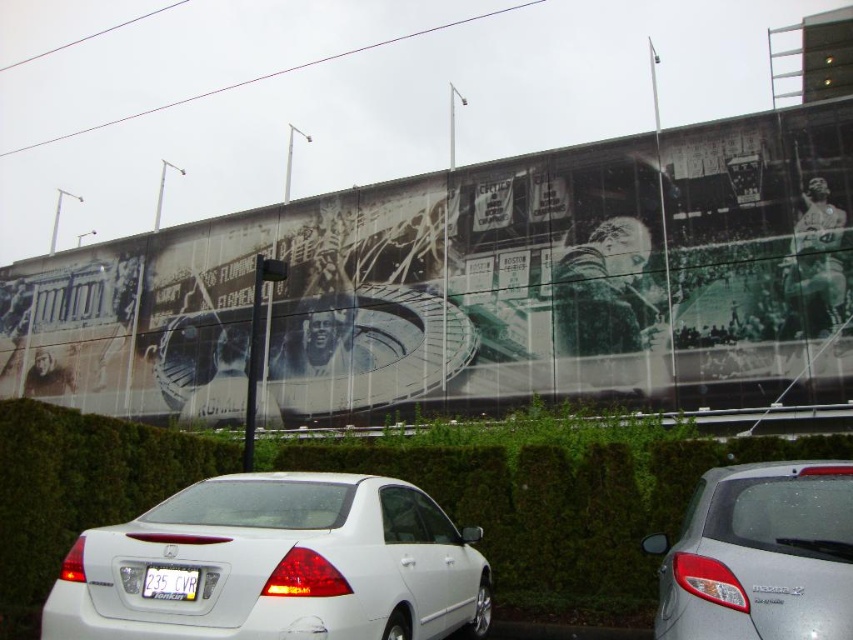
Question: Does black and white mural at center have a smaller size compared to white plastic license plate at center?

Choices:
 (A) yes
 (B) no

Answer: (B)

Question: Is the position of black and white mural at center less distant than that of silver metallic hatchback at center?

Choices:
 (A) yes
 (B) no

Answer: (B)

Question: From the image, what is the correct spatial relationship of black and white mural at center in relation to white glossy sedan at center?

Choices:
 (A) left
 (B) right

Answer: (A)

Question: Which point is farther to the camera?

Choices:
 (A) (61, 440)
 (B) (378, 588)
 (C) (672, 632)

Answer: (A)

Question: Which point appears farthest from the camera in this image?

Choices:
 (A) click(x=495, y=508)
 (B) click(x=675, y=346)

Answer: (B)

Question: Which point is farther from the camera taking this photo?

Choices:
 (A) (16, 630)
 (B) (384, 525)

Answer: (A)